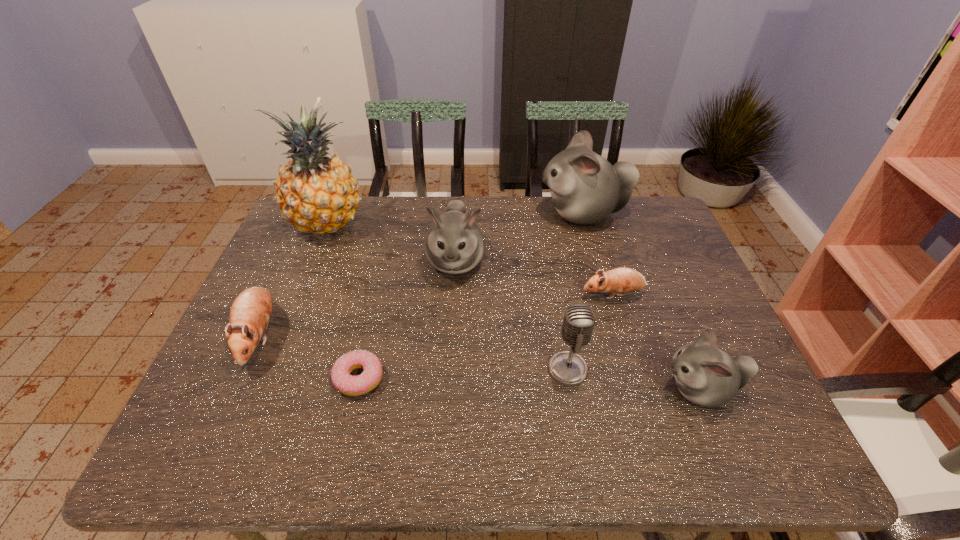
Where is `free space between the nearest white hamster and the pineapple`? free space between the nearest white hamster and the pineapple is located at coordinates (514, 306).

Locate an element on the screen. The height and width of the screenshot is (540, 960). free spot between the shortest object and the tallest object is located at coordinates (343, 301).

Locate an element on the screen. The width and height of the screenshot is (960, 540). free space between the right brown hamster and the bigger brown hamster is located at coordinates (437, 315).

Find the location of a particular element. vacant region between the third tallest hamster and the farthest white hamster is located at coordinates (641, 302).

Where is `free space between the yellow pineapple and the third tallest hamster`? Image resolution: width=960 pixels, height=540 pixels. free space between the yellow pineapple and the third tallest hamster is located at coordinates (514, 306).

You are a GUI agent. You are given a task and a screenshot of the screen. Output one action in this format:
    pyautogui.click(x=<x>, y=<y>)
    Task: Click on the vacant space in between the smallest white hamster and the microphone
    The height and width of the screenshot is (540, 960).
    Given the screenshot: What is the action you would take?
    pyautogui.click(x=634, y=379)

Locate an element on the screen. The height and width of the screenshot is (540, 960). unoccupied position between the farthest white hamster and the second nearest white hamster is located at coordinates (519, 238).

Identify which object is the third nearest to the yellow pineapple. Please provide its 2D coordinates. Your answer should be formatted as a tuple, i.e. [(x, y)], where the tuple contains the x and y coordinates of a point satisfying the conditions above.

[(349, 385)]

Locate an element on the screen. The image size is (960, 540). object identified as the fifth closest to the gray microphone is located at coordinates (585, 188).

Choose which hamster is the third nearest neighbor to the microphone. Please provide its 2D coordinates. Your answer should be formatted as a tuple, i.e. [(x, y)], where the tuple contains the x and y coordinates of a point satisfying the conditions above.

[(454, 244)]